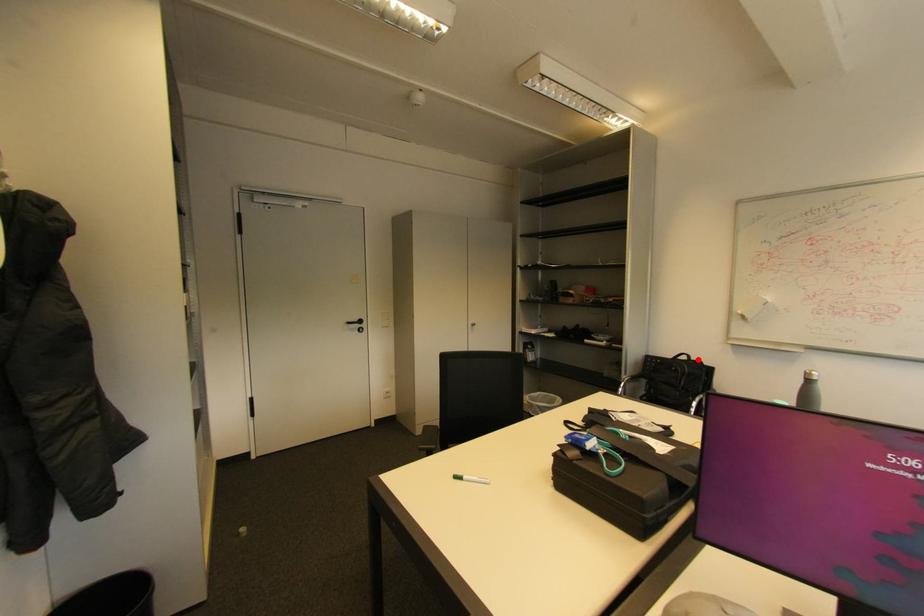
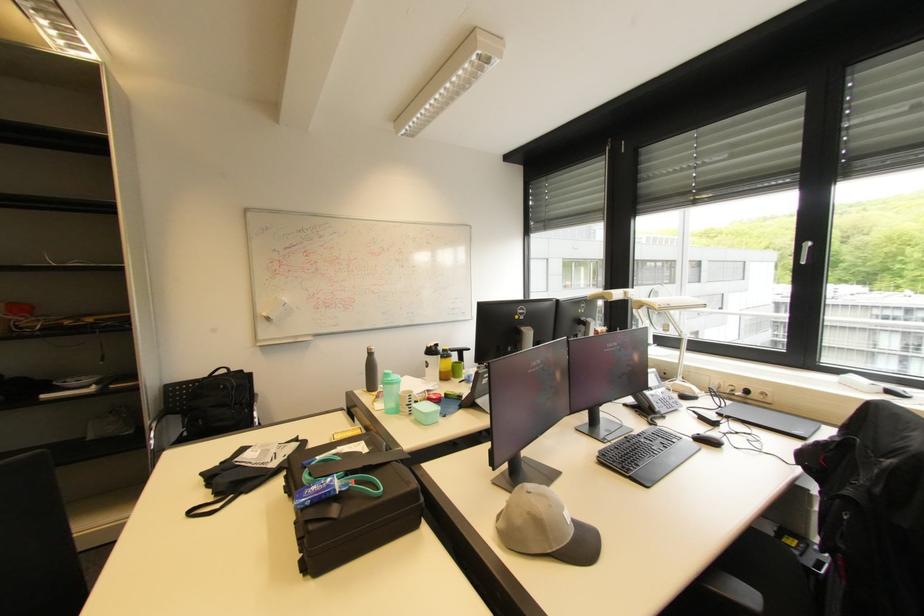
Locate, in the second image, the point that corresponds to the highlighted location in the first image.

(237, 371)